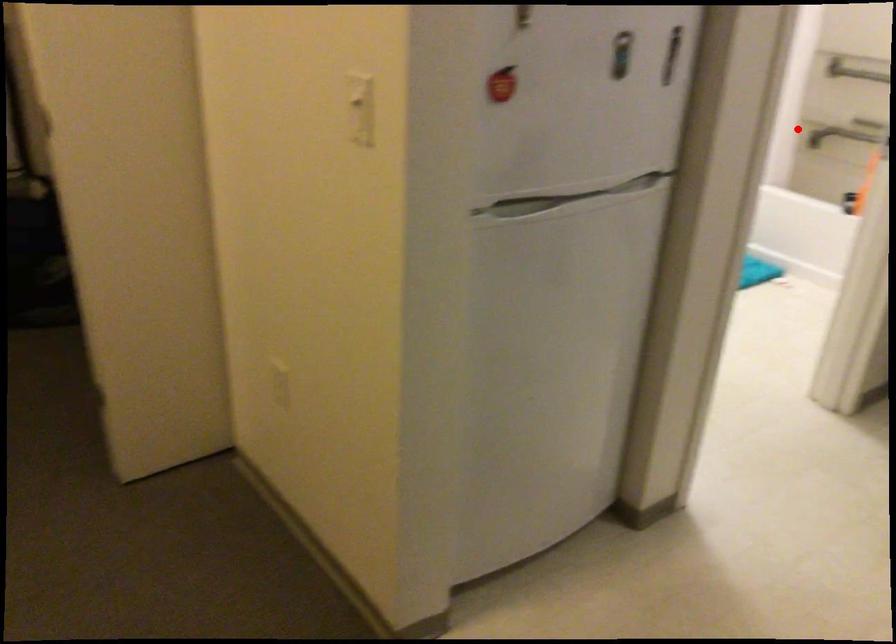
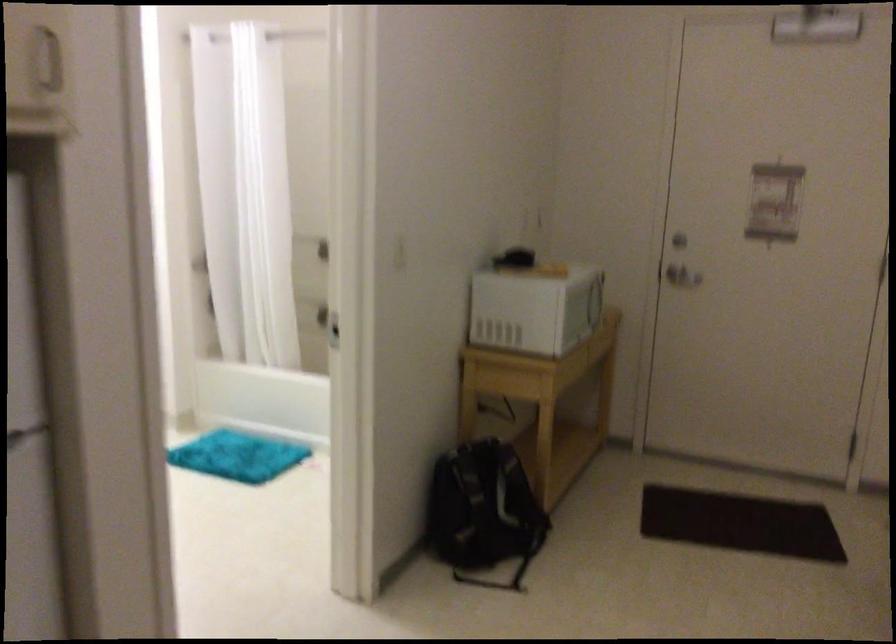
Where in the second image is the point corresponding to the highlighted location from the first image?

(312, 310)